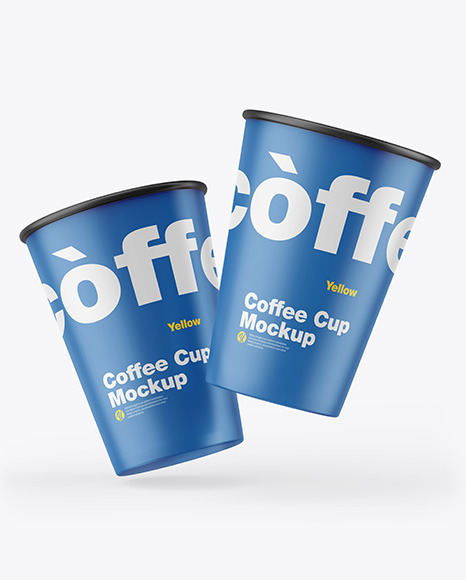
The width and height of the screenshot is (466, 580). I want to click on cup on the right, so click(325, 376).